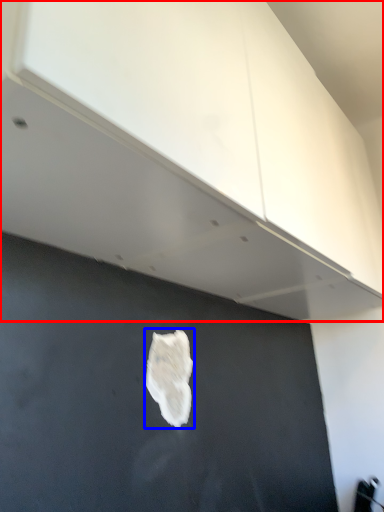
Question: Which of the following is the closest to the observer, cabinetry (highlighted by a red box) or patch (highlighted by a blue box)?

Choices:
 (A) cabinetry
 (B) patch

Answer: (A)